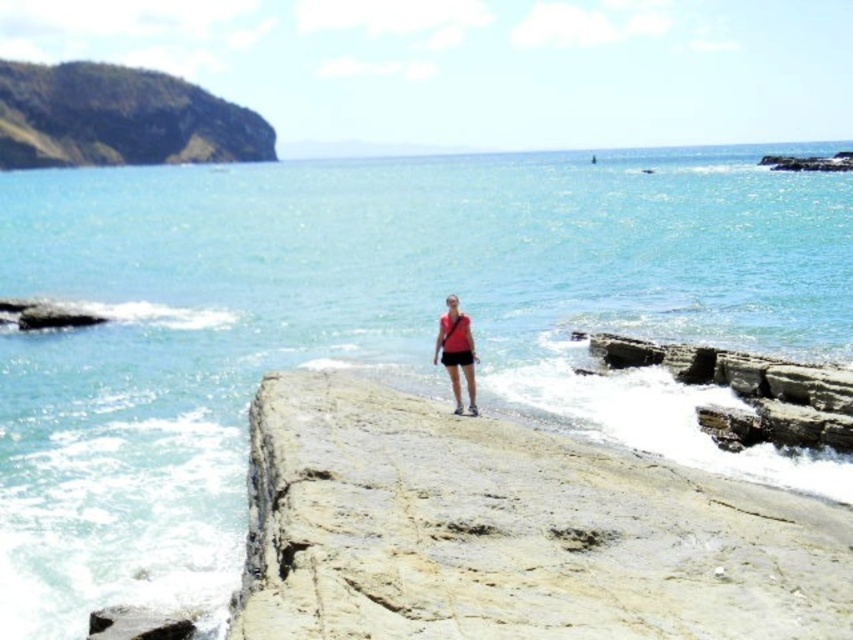
Question: Among these objects, which one is farthest from the camera?

Choices:
 (A) green mossy rock at upper left
 (B) smooth beige rock at center
 (C) rough stone rock at lower right

Answer: (A)

Question: Is rough stone rock at lower right below matte red shirt at center?

Choices:
 (A) no
 (B) yes

Answer: (B)

Question: Does smooth beige rock at center have a smaller size compared to green mossy rock at upper left?

Choices:
 (A) no
 (B) yes

Answer: (B)

Question: Which object is closer to the camera taking this photo?

Choices:
 (A) matte red shirt at center
 (B) smooth beige rock at center
 (C) green mossy rock at upper left
 (D) rough stone rock at lower right

Answer: (B)

Question: Among these points, which one is nearest to the camera?

Choices:
 (A) (715, 353)
 (B) (456, 321)
 (C) (172, 145)
 (D) (788, 525)

Answer: (D)

Question: Is the position of green mossy rock at upper left more distant than that of matte red shirt at center?

Choices:
 (A) yes
 (B) no

Answer: (A)